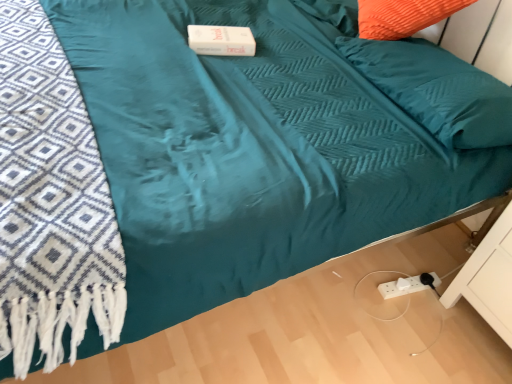
Image resolution: width=512 pixels, height=384 pixels. Describe the element at coordinates (488, 278) in the screenshot. I see `white matte drawer at lower right` at that location.

In order to click on white matte drawer at lower right in this screenshot , I will do `click(488, 278)`.

This screenshot has height=384, width=512. I want to click on teal fabric pillow at upper right, so coord(436,90).

Image resolution: width=512 pixels, height=384 pixels. What do you see at coordinates (436, 90) in the screenshot?
I see `teal fabric pillow at upper right` at bounding box center [436, 90].

Identify the location of white matte drawer at lower right. The width and height of the screenshot is (512, 384). (488, 278).

Is white matte drawer at lower right to the left or to the right of teal fabric pillow at upper right in the image?

white matte drawer at lower right is positioned on teal fabric pillow at upper right's right side.

Between white matte drawer at lower right and teal fabric pillow at upper right, which one is positioned in front?

white matte drawer at lower right is more forward.

Is point (507, 273) closer or farther from the camera than point (466, 86)?

Point (507, 273) is farther from the camera than point (466, 86).

From the image's perspective, does white matte drawer at lower right appear higher than teal fabric pillow at upper right?

Actually, white matte drawer at lower right appears below teal fabric pillow at upper right in the image.

From a real-world perspective, is white matte drawer at lower right physically below teal fabric pillow at upper right?

Yes, from a real-world perspective, white matte drawer at lower right is below teal fabric pillow at upper right.

Based on the photo, in terms of width, does white matte drawer at lower right look wider or thinner when compared to teal fabric pillow at upper right?

Considering their sizes, white matte drawer at lower right looks slimmer than teal fabric pillow at upper right.

Which of these two, white matte drawer at lower right or teal fabric pillow at upper right, stands shorter?

teal fabric pillow at upper right is shorter.

Is white matte drawer at lower right smaller than teal fabric pillow at upper right?

No.

Do you think white matte drawer at lower right is within teal fabric pillow at upper right, or outside of it?

white matte drawer at lower right is not enclosed by teal fabric pillow at upper right.

Are white matte drawer at lower right and teal fabric pillow at upper right located far from each other?

white matte drawer at lower right is near teal fabric pillow at upper right, not far away.

Could you tell me if white matte drawer at lower right is turned towards teal fabric pillow at upper right?

No, white matte drawer at lower right does not turn towards teal fabric pillow at upper right.

Can you tell me how much white matte drawer at lower right and teal fabric pillow at upper right differ in facing direction?

5.99 degrees separate the facing orientations of white matte drawer at lower right and teal fabric pillow at upper right.

How distant is white matte drawer at lower right from teal fabric pillow at upper right?

white matte drawer at lower right is 48.05 centimeters from teal fabric pillow at upper right.

Identify the location of drawer lying on the right of teal fabric pillow at upper right. (488, 278).

Can you confirm if teal fabric pillow at upper right is positioned to the left of white matte drawer at lower right?

Correct, you'll find teal fabric pillow at upper right to the left of white matte drawer at lower right.

Is teal fabric pillow at upper right positioned before white matte drawer at lower right?

No, it is behind white matte drawer at lower right.

Between point (490, 91) and point (498, 320), which one is positioned in front?

The point (490, 91) is in front.

From the image's perspective, is teal fabric pillow at upper right beneath white matte drawer at lower right?

Actually, teal fabric pillow at upper right appears above white matte drawer at lower right in the image.

From a real-world perspective, is teal fabric pillow at upper right positioned under white matte drawer at lower right based on gravity?

No, from a real-world perspective, teal fabric pillow at upper right is not beneath white matte drawer at lower right.

Which of these two, teal fabric pillow at upper right or white matte drawer at lower right, is wider?

teal fabric pillow at upper right.

In terms of height, does teal fabric pillow at upper right look taller or shorter compared to white matte drawer at lower right?

Clearly, teal fabric pillow at upper right is shorter compared to white matte drawer at lower right.

From the picture: Who is smaller, teal fabric pillow at upper right or white matte drawer at lower right?

teal fabric pillow at upper right is smaller.

Is teal fabric pillow at upper right spatially inside white matte drawer at lower right, or outside of it?

teal fabric pillow at upper right lies outside white matte drawer at lower right.

Is teal fabric pillow at upper right next to white matte drawer at lower right?

teal fabric pillow at upper right and white matte drawer at lower right are clearly separated.

Is teal fabric pillow at upper right oriented towards white matte drawer at lower right?

No, teal fabric pillow at upper right is not oriented towards white matte drawer at lower right.

Consider the image. Can you tell me how much teal fabric pillow at upper right and white matte drawer at lower right differ in facing direction?

teal fabric pillow at upper right and white matte drawer at lower right are facing 5.99 degrees away from each other.

Where is `drawer in front of the teal fabric pillow at upper right`? This screenshot has width=512, height=384. drawer in front of the teal fabric pillow at upper right is located at coordinates pos(488,278).

In order to click on pillow above the white matte drawer at lower right (from the image's perspective) in this screenshot , I will do `click(436, 90)`.

Find the location of a particular element. The image size is (512, 384). drawer lying on the right of teal fabric pillow at upper right is located at coordinates (488, 278).